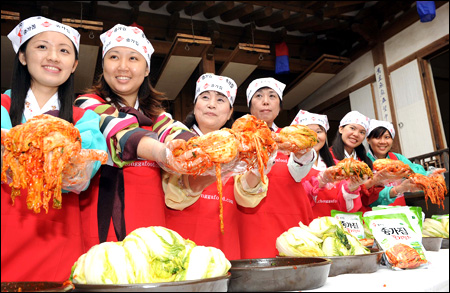
What are the coordinates of `pans` in the screenshot? It's located at (280, 277), (210, 289), (349, 264), (432, 244).